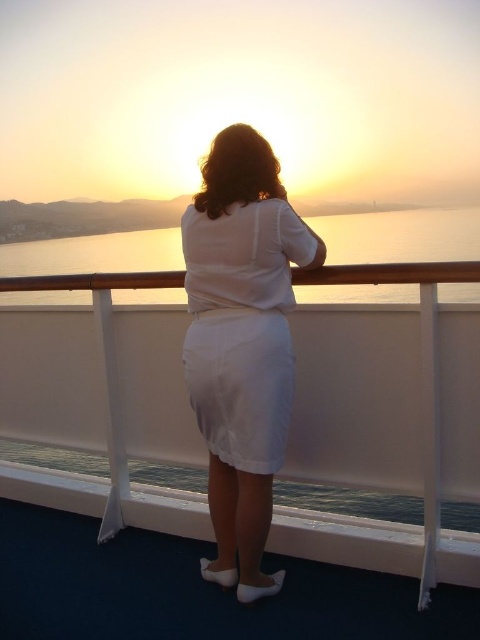
Question: Does white satin skirt at center have a greater width compared to matte water at center?

Choices:
 (A) yes
 (B) no

Answer: (B)

Question: Does white satin skirt at center have a lesser width compared to matte water at center?

Choices:
 (A) yes
 (B) no

Answer: (A)

Question: Among these points, which one is nearest to the camera?

Choices:
 (A) (251, 456)
 (B) (372, 248)

Answer: (A)

Question: From the image, what is the correct spatial relationship of white satin skirt at center in relation to matte water at center?

Choices:
 (A) above
 (B) below

Answer: (B)